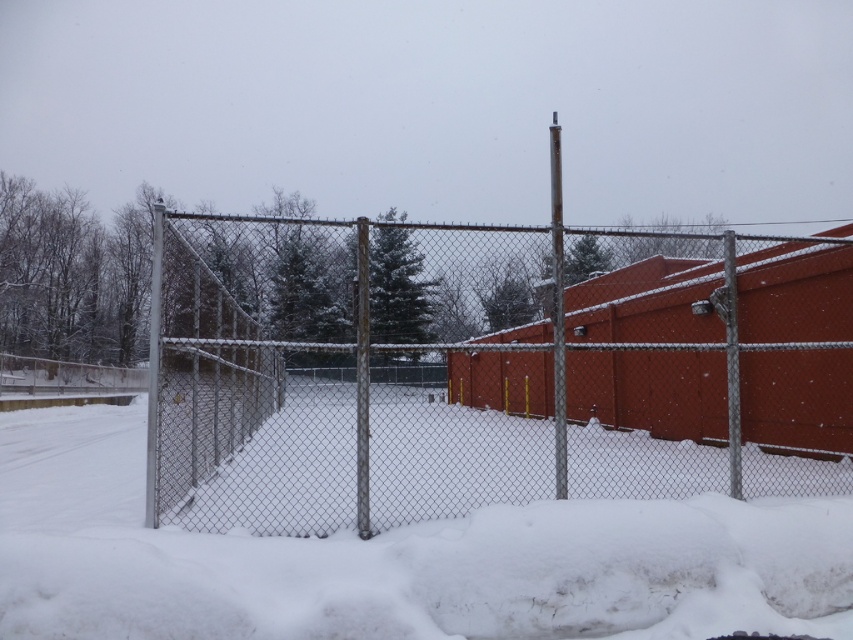
Question: Does rusty chain-link fence at center have a smaller size compared to white fluffy snow at center?

Choices:
 (A) yes
 (B) no

Answer: (B)

Question: Which of the following is the closest to the observer?

Choices:
 (A) white fluffy snow at center
 (B) rusty chain-link fence at center

Answer: (A)

Question: Is rusty chain-link fence at center further to camera compared to white fluffy snow at center?

Choices:
 (A) no
 (B) yes

Answer: (B)

Question: Does rusty chain-link fence at center have a larger size compared to white fluffy snow at center?

Choices:
 (A) yes
 (B) no

Answer: (A)

Question: Which object appears farthest from the camera in this image?

Choices:
 (A) white fluffy snow at center
 (B) rusty chain-link fence at center

Answer: (B)